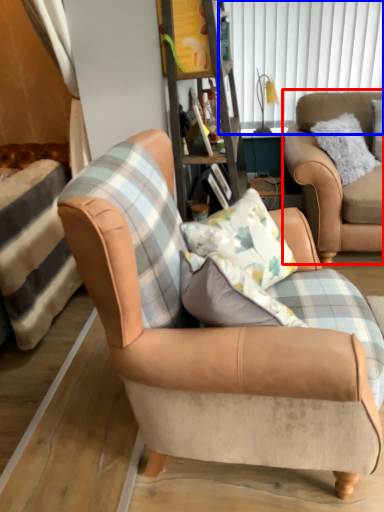
Question: Which object appears farthest to the camera in this image, chair (highlighted by a red box) or window screen (highlighted by a blue box)?

Choices:
 (A) chair
 (B) window screen

Answer: (B)